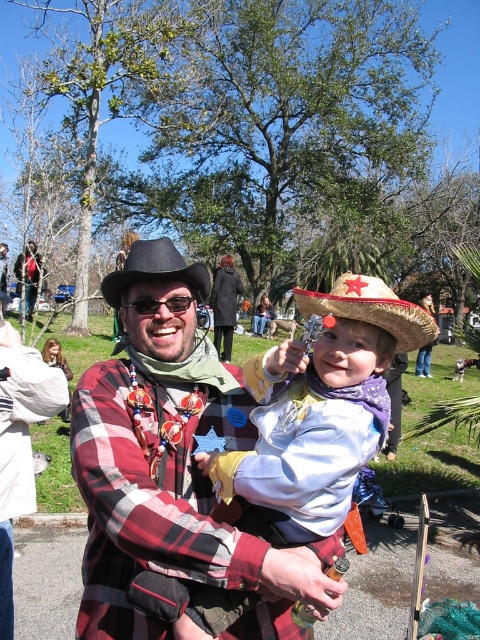
Consider the image. You are standing in the park and see the glittery straw hat at center and the black felt cowboy hat at center. Which hat is nearer to you?

The glittery straw hat at center is closer to the viewer than the black felt cowboy hat at center, so the glittery straw hat at center is nearer to you.

You are trying to decide which item to pack first for a picnic based on size. You have the plaid fabric shirt at center and the black felt cowboy hat at center. Which item takes up more space?

The plaid fabric shirt at center is bigger than the black felt cowboy hat at center, so it takes up more space.